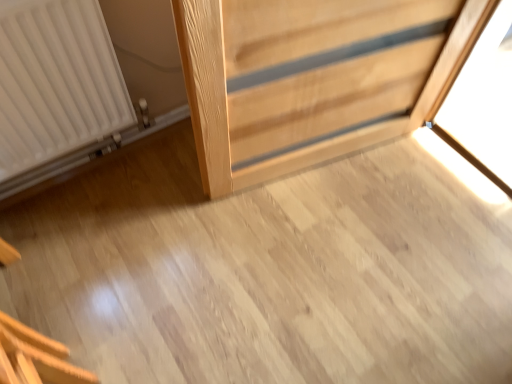
Where is `vacant space underneath white textured radiator at lower left (from a real-world perspective)`? The height and width of the screenshot is (384, 512). vacant space underneath white textured radiator at lower left (from a real-world perspective) is located at coordinates (90, 172).